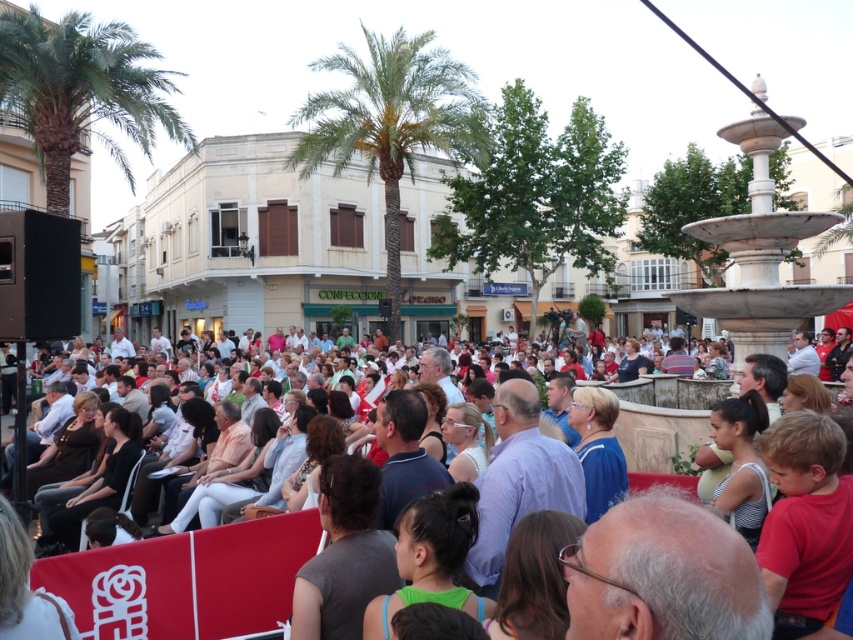
You are a photographer trying to capture a clear shot of the white marble fountain at right without the green leafy palm tree at center blocking it. Based on their positions, is this possible?

The green leafy palm tree at center is positioned over the white marble fountain at right, so it would block the view. To capture the fountain clearly, you need to move to a position where the palm tree is not directly in front of the fountain.

You are standing in the town square and want to reach the white marble fountain at right. Which direction should you move relative to the matte white crowd at center?

You should move away from the matte white crowd at center towards the white marble fountain at right since the crowd is closer to you than the fountain.